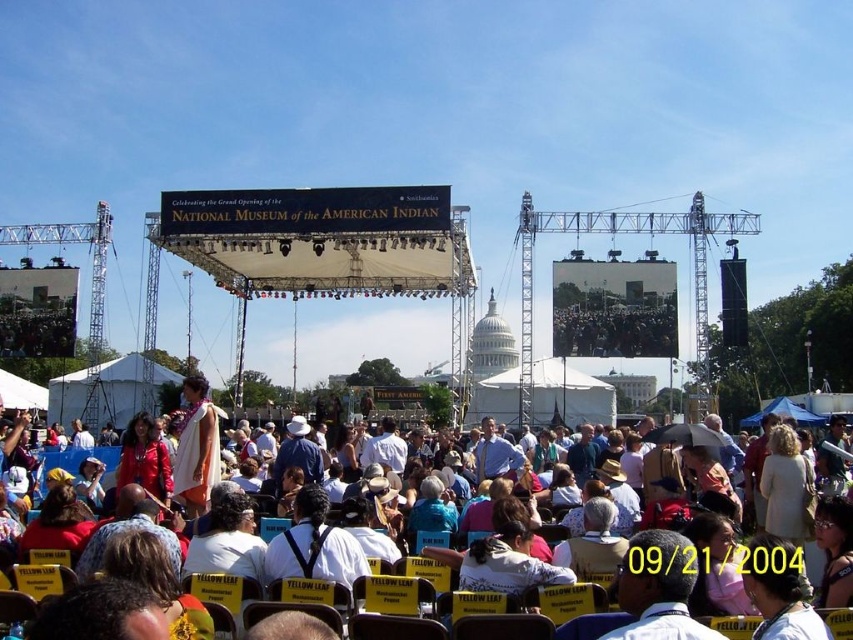
Question: Is white cotton shirt at center behind denim jacket at center?

Choices:
 (A) no
 (B) yes

Answer: (A)

Question: Which object is positioned closest to the matte red jacket at center?

Choices:
 (A) denim jacket at center
 (B) white cotton shirt at center
 (C) white fabric crowd at center

Answer: (B)

Question: Can you confirm if white fabric crowd at center is positioned above matte red jacket at center?

Choices:
 (A) yes
 (B) no

Answer: (B)

Question: Among these points, which one is nearest to the camera?

Choices:
 (A) (635, 573)
 (B) (300, 428)
 (C) (781, 618)

Answer: (C)

Question: Where is white shirt at center located in relation to white cotton shirt at center in the image?

Choices:
 (A) above
 (B) below

Answer: (B)

Question: Among these points, which one is nearest to the camera?

Choices:
 (A) (318, 524)
 (B) (144, 458)

Answer: (A)